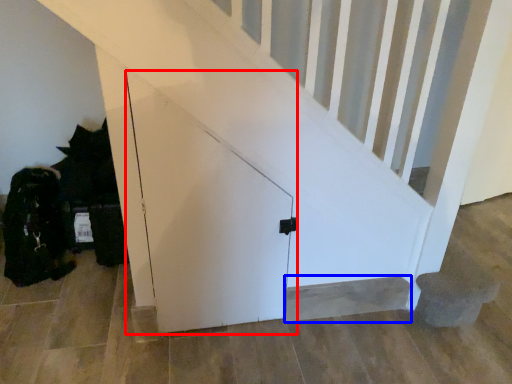
Question: Which object is further to the camera taking this photo, door (highlighted by a red box) or stairwell (highlighted by a blue box)?

Choices:
 (A) door
 (B) stairwell

Answer: (B)